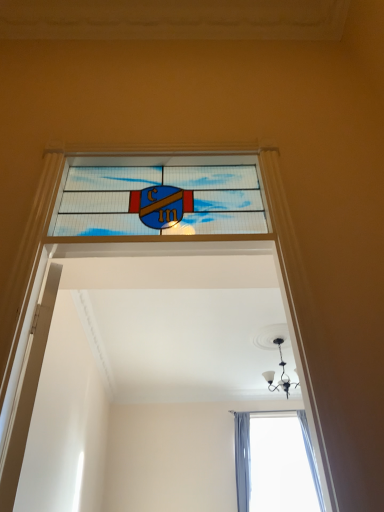
The width and height of the screenshot is (384, 512). Describe the element at coordinates (281, 374) in the screenshot. I see `black glass chandelier at upper center` at that location.

What is the approximate height of black glass chandelier at upper center?

The height of black glass chandelier at upper center is 25.33 inches.

Find the location of `stained glass window at center`. stained glass window at center is located at coordinates (161, 201).

Locate an element on the screen. The width and height of the screenshot is (384, 512). white glossy door at left is located at coordinates (28, 393).

Can you tell me how much stained glass window at center and white glossy door at left differ in facing direction?

The facing directions of stained glass window at center and white glossy door at left are 66.3 degrees apart.

From a real-world perspective, relative to white glossy door at left, is stained glass window at center vertically above or below?

stained glass window at center is above white glossy door at left.

Is stained glass window at center next to white glossy door at left?

stained glass window at center and white glossy door at left are not in contact.

Is stained glass window at center thinner than white glossy door at left?

No, stained glass window at center is not thinner than white glossy door at left.

Based on their positions, is white glossy door at left located to the left or right of stained glass window at center?

Clearly, white glossy door at left is on the left of stained glass window at center in the image.

Is white glossy door at left aimed at stained glass window at center?

No, white glossy door at left does not turn towards stained glass window at center.

How far apart are white glossy door at left and stained glass window at center?

white glossy door at left is 18.98 inches from stained glass window at center.

Can we say white glossy door at left lies outside stained glass window at center?

Yes, white glossy door at left is located beyond the bounds of stained glass window at center.

Is black glass chandelier at upper center situated inside white glossy door at left or outside?

black glass chandelier at upper center is outside white glossy door at left.

Is black glass chandelier at upper center beside white glossy door at left?

black glass chandelier at upper center and white glossy door at left are not in contact.

How distant is black glass chandelier at upper center from white glossy door at left?

The distance of black glass chandelier at upper center from white glossy door at left is 16.12 feet.

How many degrees apart are the facing directions of black glass chandelier at upper center and white glossy door at left?

114 degrees separate the facing orientations of black glass chandelier at upper center and white glossy door at left.

Based on their positions, is black glass chandelier at upper center located to the left or right of stained glass window at center?

black glass chandelier at upper center is to the right of stained glass window at center.

From the image's perspective, is black glass chandelier at upper center above stained glass window at center?

No, from the image's perspective, black glass chandelier at upper center is not above stained glass window at center.

Could you tell me if black glass chandelier at upper center is facing stained glass window at center?

Yes, black glass chandelier at upper center is aimed at stained glass window at center.

Could stained glass window at center be considered to be inside black glass chandelier at upper center?

No, stained glass window at center is not surrounded by black glass chandelier at upper center.

From the image's perspective, is stained glass window at center above black glass chandelier at upper center?

Indeed, from the image's perspective, stained glass window at center is shown above black glass chandelier at upper center.

Considering the relative sizes of stained glass window at center and black glass chandelier at upper center in the image provided, is stained glass window at center thinner than black glass chandelier at upper center?

Correct, the width of stained glass window at center is less than that of black glass chandelier at upper center.

From the picture: Considering their positions, is stained glass window at center located in front of or behind black glass chandelier at upper center?

stained glass window at center is positioned closer to the viewer than black glass chandelier at upper center.

Is black glass chandelier at upper center located within stained glass window at center?

No, black glass chandelier at upper center is located outside of stained glass window at center.

Is white glossy door at left outside of black glass chandelier at upper center?

Yes, white glossy door at left is located beyond the bounds of black glass chandelier at upper center.

Is white glossy door at left facing away from black glass chandelier at upper center?

That's not correct — white glossy door at left is not looking away from black glass chandelier at upper center.

Is white glossy door at left thinner than black glass chandelier at upper center?

Yes, white glossy door at left is thinner than black glass chandelier at upper center.

Can you confirm if white glossy door at left is shorter than black glass chandelier at upper center?

Incorrect, the height of white glossy door at left does not fall short of that of black glass chandelier at upper center.

This screenshot has width=384, height=512. Find the location of `window that is behind the white glossy door at left`. window that is behind the white glossy door at left is located at coordinates (161, 201).

You are a GUI agent. You are given a task and a screenshot of the screen. Output one action in this format:
    pyautogui.click(x=<x>, y=<y>)
    Task: Click on the window lying on the right of white glossy door at left
    The width and height of the screenshot is (384, 512).
    Given the screenshot: What is the action you would take?
    pyautogui.click(x=161, y=201)

Estimate the real-world distances between objects in this image. Which object is closer to stained glass window at center, white glossy door at left or black glass chandelier at upper center?

Based on the image, white glossy door at left appears to be nearer to stained glass window at center.

When comparing their distances from black glass chandelier at upper center, does white glossy door at left or stained glass window at center seem further?

The object further to black glass chandelier at upper center is white glossy door at left.

Looking at this image, estimate the real-world distances between objects in this image. Which object is closer to black glass chandelier at upper center, stained glass window at center or white glossy door at left?

Based on the image, stained glass window at center appears to be nearer to black glass chandelier at upper center.

Based on their spatial positions, is black glass chandelier at upper center or white glossy door at left closer to stained glass window at center?

Among the two, white glossy door at left is located nearer to stained glass window at center.

From the image, which object appears to be nearer to white glossy door at left, black glass chandelier at upper center or stained glass window at center?

stained glass window at center.

When comparing their distances from white glossy door at left, does stained glass window at center or black glass chandelier at upper center seem closer?

Based on the image, stained glass window at center appears to be nearer to white glossy door at left.

Find the location of a particular element. The height and width of the screenshot is (512, 384). window between white glossy door at left and black glass chandelier at upper center along the z-axis is located at coordinates (161, 201).